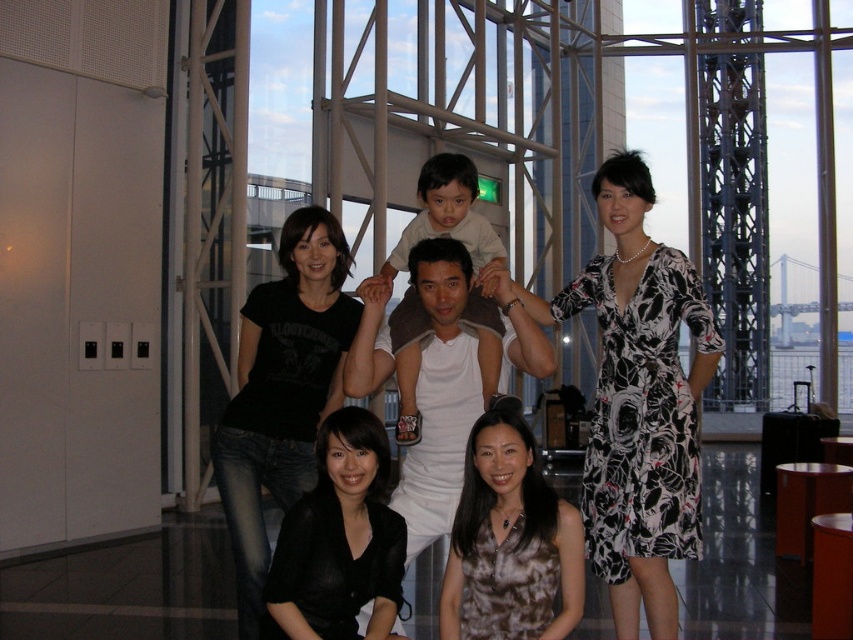
Question: Is black floral dress at center closer to camera compared to black matte shirt at lower center?

Choices:
 (A) yes
 (B) no

Answer: (B)

Question: Which object is closer to the camera taking this photo?

Choices:
 (A) black matte shirt at lower center
 (B) black cotton t-shirt at center
 (C) black floral dress at center

Answer: (A)

Question: Does black floral dress at center come in front of black cotton t-shirt at center?

Choices:
 (A) no
 (B) yes

Answer: (A)

Question: Estimate the real-world distances between objects in this image. Which object is closer to the camouflage-patterned dress at lower center?

Choices:
 (A) black cotton t-shirt at center
 (B) black floral dress at center
 (C) brown printed dress at lower center

Answer: (C)

Question: Does black floral dress at center have a larger size compared to black matte shirt at lower center?

Choices:
 (A) yes
 (B) no

Answer: (A)

Question: Which point is closer to the camera?

Choices:
 (A) (349, 468)
 (B) (225, 515)
 (C) (494, 467)
 (D) (701, 312)

Answer: (A)